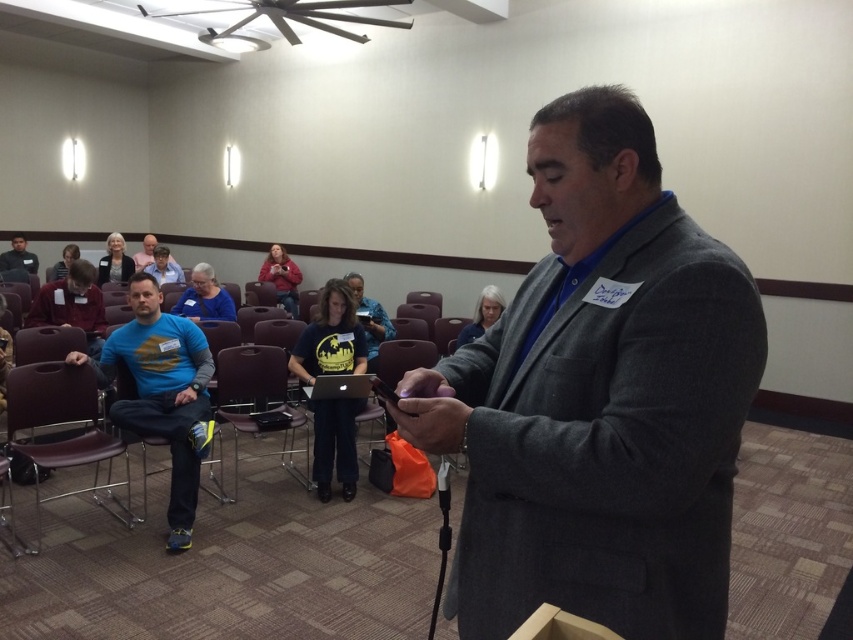
Find the location of a particular element. This screenshot has height=640, width=853. brown plastic chair at center is located at coordinates (258, 403).

Which of these two, brown plastic chair at center or dark gray shirt at lower left, stands shorter?

With less height is dark gray shirt at lower left.

Measure the distance between brown plastic chair at center and camera.

The distance of brown plastic chair at center from camera is 12.00 feet.

This screenshot has height=640, width=853. In order to click on brown plastic chair at center in this screenshot , I will do `click(258, 403)`.

Looking at this image, is burgundy plastic chair at lower left wider than dark gray shirt at lower left?

Yes.

Find the location of a particular element. The width and height of the screenshot is (853, 640). burgundy plastic chair at lower left is located at coordinates (61, 422).

Is blue t-shirt at center wider than matte red sweater at center?

Indeed, blue t-shirt at center has a greater width compared to matte red sweater at center.

Who is shorter, blue t-shirt at center or matte red sweater at center?

With less height is matte red sweater at center.

Who is more distant from viewer, (136,365) or (293,272)?

The point (293,272) is more distant.

Identify the location of blue t-shirt at center. The height and width of the screenshot is (640, 853). (163, 394).